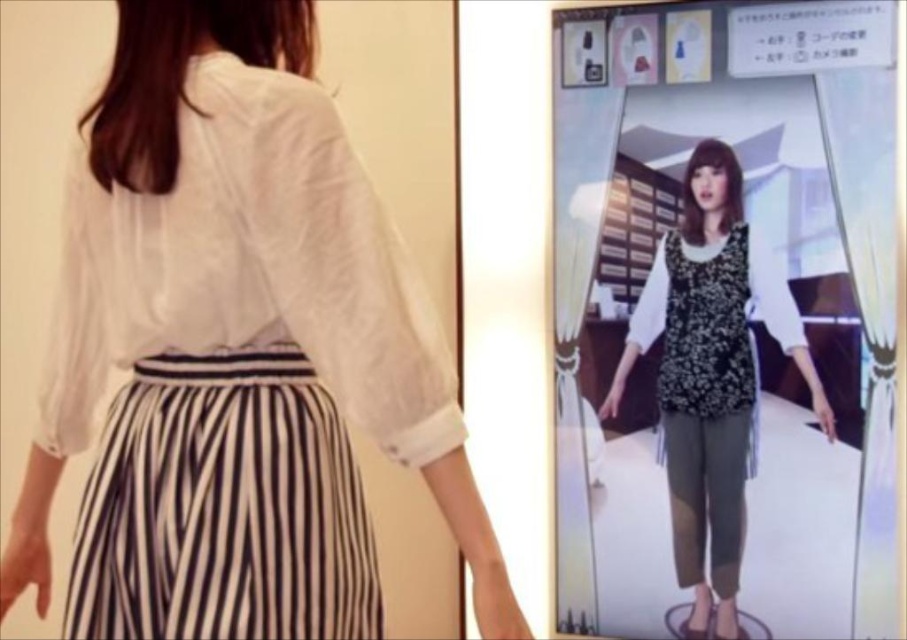
Does white sheer blouse at upper left have a greater width compared to floral-patterned fabric top at center?

Yes.

Who is more forward, (192, 84) or (691, 614)?

Positioned in front is point (192, 84).

At what (x,y) coordinates should I click in order to perform the action: click on white sheer blouse at upper left. Please return your answer as a coordinate pair (x, y). Looking at the image, I should click on (250, 268).